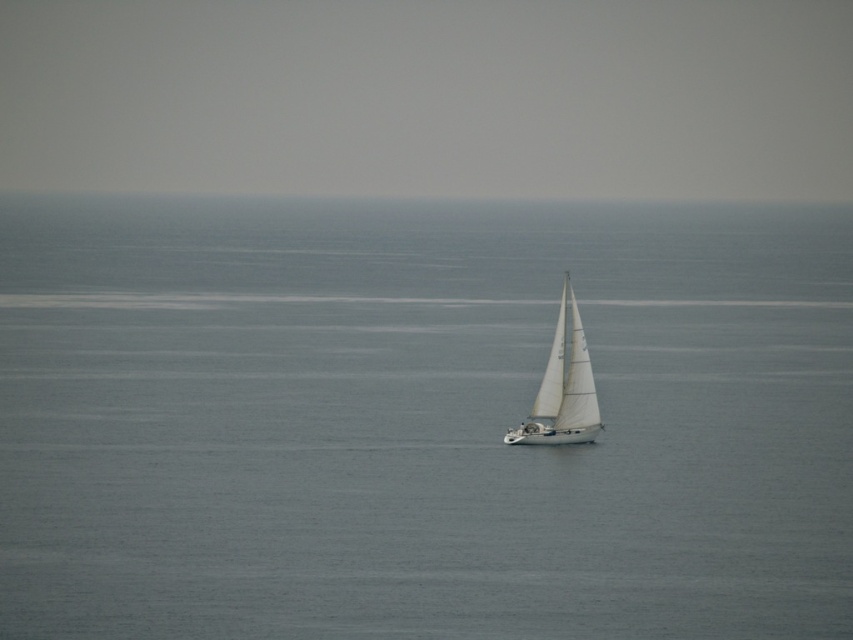
Question: Can you confirm if gray water at center is positioned to the right of white matte sailboat at center?

Choices:
 (A) yes
 (B) no

Answer: (B)

Question: Is gray water at center wider than white matte sailboat at center?

Choices:
 (A) no
 (B) yes

Answer: (B)

Question: Among these objects, which one is farthest from the camera?

Choices:
 (A) gray water at center
 (B) white matte sailboat at center

Answer: (B)

Question: Does gray water at center have a greater width compared to white matte sailboat at center?

Choices:
 (A) yes
 (B) no

Answer: (A)